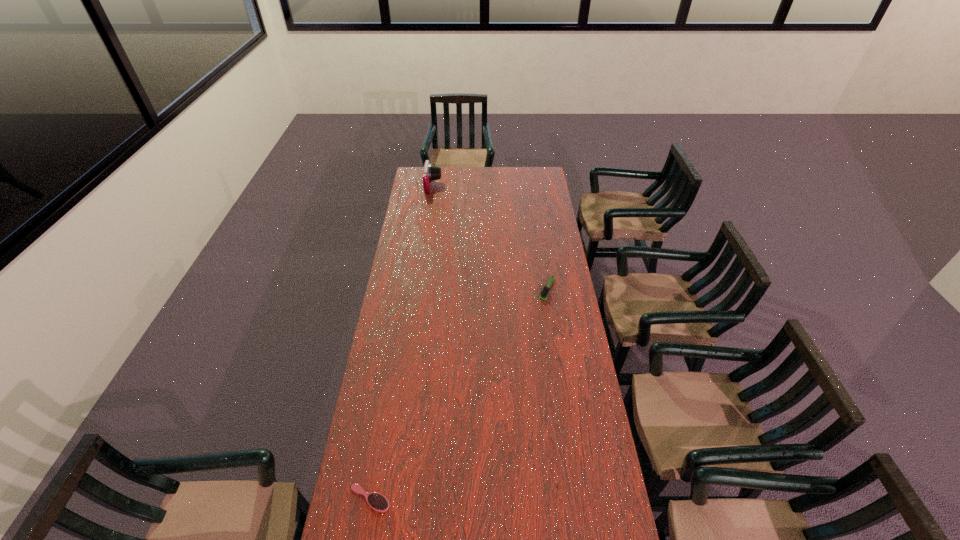
Find the location of `vacant space that satisfies the following two spatial constraints: 1. on the front-facing side of the taller hairbrush; 2. on the right side of the farthest object`. vacant space that satisfies the following two spatial constraints: 1. on the front-facing side of the taller hairbrush; 2. on the right side of the farthest object is located at coordinates (419, 289).

The width and height of the screenshot is (960, 540). Identify the location of blank space that satisfies the following two spatial constraints: 1. on the back side of the right hairbrush; 2. on the right side of the shortest object. (405, 289).

Where is `blank area in the image that satisfies the following two spatial constraints: 1. on the back side of the second nearest object; 2. on the front-facing side of the farthest object`? This screenshot has height=540, width=960. blank area in the image that satisfies the following two spatial constraints: 1. on the back side of the second nearest object; 2. on the front-facing side of the farthest object is located at coordinates (531, 186).

The width and height of the screenshot is (960, 540). What are the coordinates of `vacant space that satisfies the following two spatial constraints: 1. on the front-facing side of the farther hairbrush; 2. on the left side of the farthest object` in the screenshot? It's located at (419, 289).

At what (x,y) coordinates should I click in order to perform the action: click on vacant region that satisfies the following two spatial constraints: 1. on the front-facing side of the taller hairbrush; 2. on the right side of the farthest object. Please return your answer as a coordinate pair (x, y). Looking at the image, I should click on [x=419, y=289].